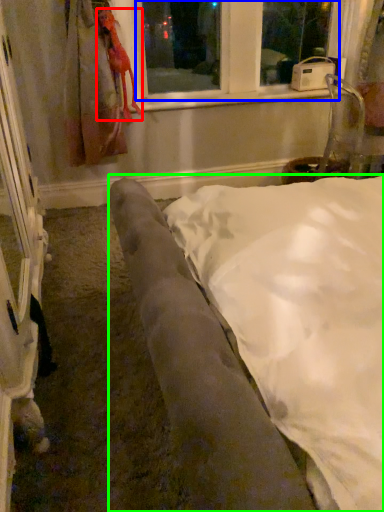
Question: Which object is positioned closest to animal (highlighted by a red box)? Select from bay window (highlighted by a blue box) and furniture (highlighted by a green box).

Choices:
 (A) bay window
 (B) furniture

Answer: (A)